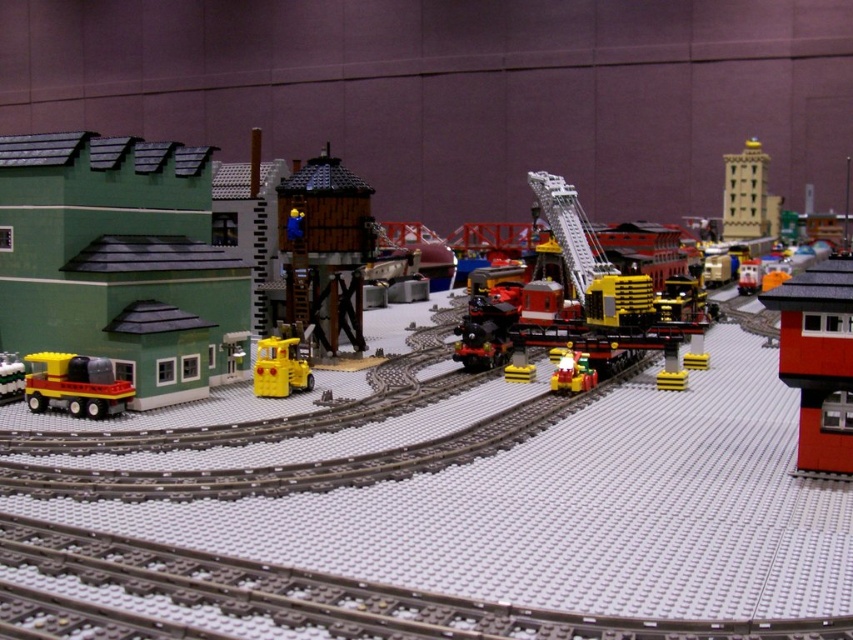
Question: In this image, where is gray plastic track at center located relative to smooth red brick building at right?

Choices:
 (A) right
 (B) left

Answer: (B)

Question: Observing the image, what is the correct spatial positioning of gray plastic track at center in reference to translucent yellow train at center?

Choices:
 (A) below
 (B) above

Answer: (B)

Question: Which of the following is the closest to the observer?

Choices:
 (A) wooden tower at center
 (B) smooth red brick building at right

Answer: (B)

Question: Is yellow plastic crane at center positioned in front of yellow plastic truck at left?

Choices:
 (A) yes
 (B) no

Answer: (B)

Question: Which point is farther to the camera?

Choices:
 (A) gray plastic track at center
 (B) smooth red brick building at right
 (C) translucent yellow train at center
 (D) matte green building at left

Answer: (C)

Question: Which is nearer to the wooden tower at center?

Choices:
 (A) yellow plastic crane at center
 (B) smooth red brick building at right

Answer: (A)